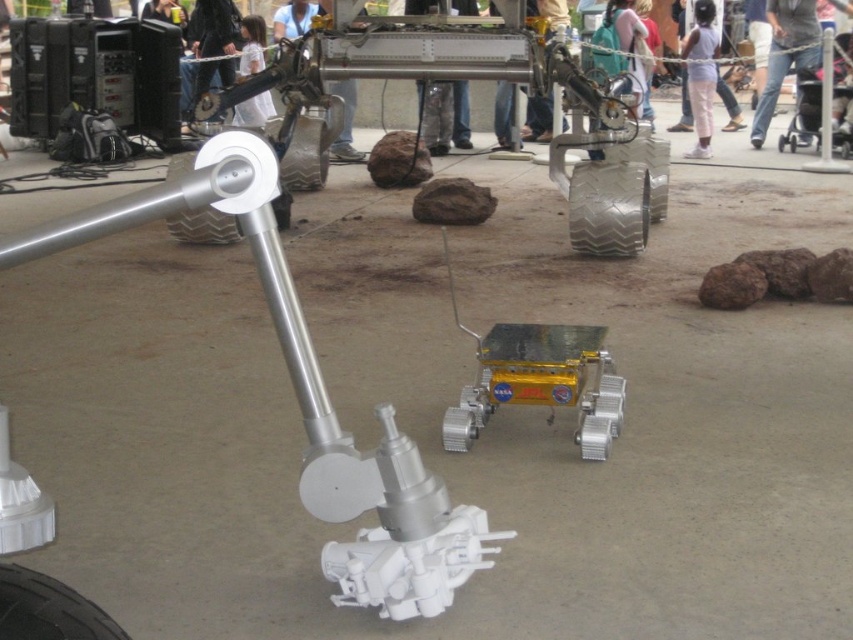
Question: Which point is closer to the camera?

Choices:
 (A) (56, 636)
 (B) (643, 218)

Answer: (A)

Question: Which object is the farthest from the white fabric shirt at upper center?

Choices:
 (A) white rubber tire at center
 (B) white cotton pants at upper right

Answer: (A)

Question: Which point appears farthest from the camera in this image?

Choices:
 (A) (55, 604)
 (B) (241, 228)
 (C) (694, 70)
 (D) (775, 32)

Answer: (D)

Question: Is the position of metallic textured tire at center more distant than that of white cotton pants at upper right?

Choices:
 (A) no
 (B) yes

Answer: (A)

Question: Can you confirm if metallic textured tire at center is smaller than white rubber tire at center?

Choices:
 (A) no
 (B) yes

Answer: (B)

Question: From the image, what is the correct spatial relationship of metallic textured tire at center in relation to black rubber tire at lower left?

Choices:
 (A) above
 (B) below

Answer: (A)